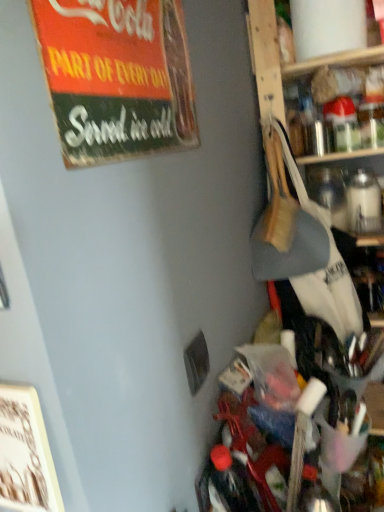
Question: Should I look upward or downward to see clear glass bottle at upper right?

Choices:
 (A) up
 (B) down

Answer: (A)

Question: Considering the relative sizes of clear glass bottle at upper right and vintage cardboard sign at upper left in the image provided, is clear glass bottle at upper right wider than vintage cardboard sign at upper left?

Choices:
 (A) yes
 (B) no

Answer: (A)

Question: Is clear glass bottle at upper right with vintage cardboard sign at upper left?

Choices:
 (A) no
 (B) yes

Answer: (A)

Question: Is the depth of clear glass bottle at upper right less than that of vintage cardboard sign at upper left?

Choices:
 (A) no
 (B) yes

Answer: (A)

Question: Does clear glass bottle at upper right have a lesser height compared to vintage cardboard sign at upper left?

Choices:
 (A) yes
 (B) no

Answer: (A)

Question: From the image's perspective, is clear glass bottle at upper right on vintage cardboard sign at upper left?

Choices:
 (A) no
 (B) yes

Answer: (B)

Question: Can you confirm if clear glass bottle at upper right is bigger than vintage cardboard sign at upper left?

Choices:
 (A) no
 (B) yes

Answer: (A)

Question: Is vintage cardboard sign at upper left positioned in front of clear glass bottle at upper right?

Choices:
 (A) no
 (B) yes

Answer: (B)

Question: Considering the relative sizes of vintage cardboard sign at upper left and clear glass bottle at upper right in the image provided, is vintage cardboard sign at upper left bigger than clear glass bottle at upper right?

Choices:
 (A) no
 (B) yes

Answer: (B)

Question: Does vintage cardboard sign at upper left touch clear glass bottle at upper right?

Choices:
 (A) yes
 (B) no

Answer: (B)

Question: Is vintage cardboard sign at upper left oriented away from clear glass bottle at upper right?

Choices:
 (A) no
 (B) yes

Answer: (A)

Question: From the image's perspective, would you say vintage cardboard sign at upper left is positioned over clear glass bottle at upper right?

Choices:
 (A) yes
 (B) no

Answer: (B)

Question: Is vintage cardboard sign at upper left facing towards clear glass bottle at upper right?

Choices:
 (A) yes
 (B) no

Answer: (B)

Question: Is vintage cardboard sign at upper left wider or thinner than clear glass bottle at upper right?

Choices:
 (A) wide
 (B) thin

Answer: (B)